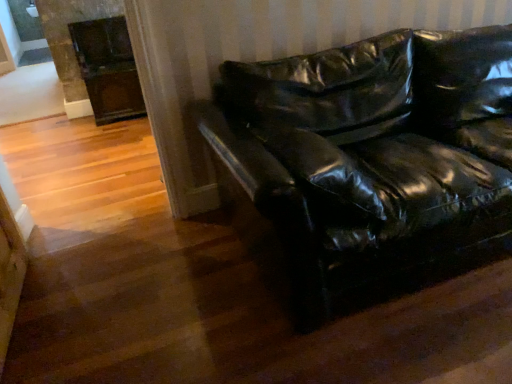
Question: In terms of width, does black leather couch at center look wider or thinner when compared to dark brown wood fireplace at upper left?

Choices:
 (A) thin
 (B) wide

Answer: (B)

Question: From their relative heights in the image, would you say black leather couch at center is taller or shorter than dark brown wood fireplace at upper left?

Choices:
 (A) short
 (B) tall

Answer: (A)

Question: Would you say black leather couch at center is to the left or to the right of dark brown wood fireplace at upper left in the picture?

Choices:
 (A) left
 (B) right

Answer: (B)

Question: Does point (37, 1) appear closer or farther from the camera than point (346, 76)?

Choices:
 (A) farther
 (B) closer

Answer: (A)

Question: Considering their positions, is dark brown wood fireplace at upper left located in front of or behind black leather couch at center?

Choices:
 (A) behind
 (B) front

Answer: (A)

Question: Considering the relative positions of dark brown wood fireplace at upper left and black leather couch at center in the image provided, is dark brown wood fireplace at upper left to the left or to the right of black leather couch at center?

Choices:
 (A) right
 (B) left

Answer: (B)

Question: In terms of size, does dark brown wood fireplace at upper left appear bigger or smaller than black leather couch at center?

Choices:
 (A) big
 (B) small

Answer: (B)